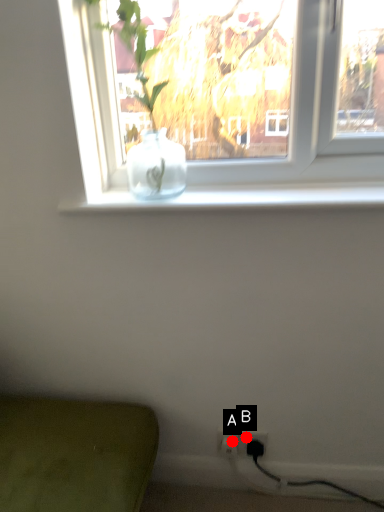
Question: Two points are circled on the image, labeled by A and B beside each circle. Which point appears closest to the camera in this image?

Choices:
 (A) A is closer
 (B) B is closer

Answer: (B)